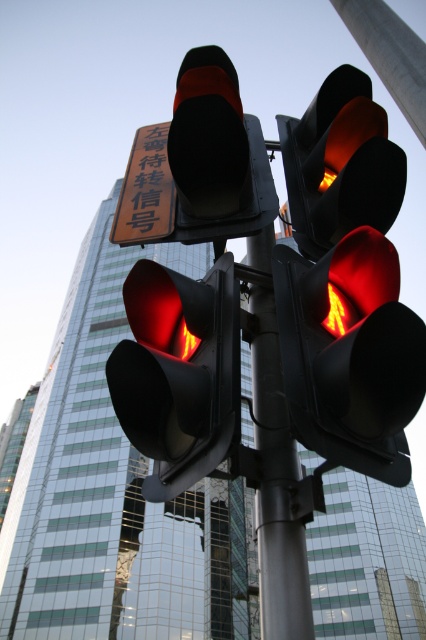
You are a city planner analyzing traffic flow. You need to determine if the matte black traffic light at left can be seen from the top of the metallic pole at center. Based on their heights, is this possible?

The matte black traffic light at left is shorter than the metallic pole at center, so it cannot be seen from the top of the metallic pole at center because it is shorter.

You are a delivery driver approaching an intersection with a matte black traffic light at left. The traffic light is showing red. According to the traffic rules displayed on the rectangular sign above, what should you do?

The matte black traffic light at left is showing red, so you must stop and wait until the light turns green before proceeding.

You are a pedestrian standing at the crosswalk and want to cross the street. There are two traffic lights ahead of you. The first is the matte black traffic light at center, and the second is the matte black traffic light at left. Which traffic light should you pay attention to for crossing?

You should pay attention to the matte black traffic light at center because it is closer to you and likely controls the crosswalk signal.